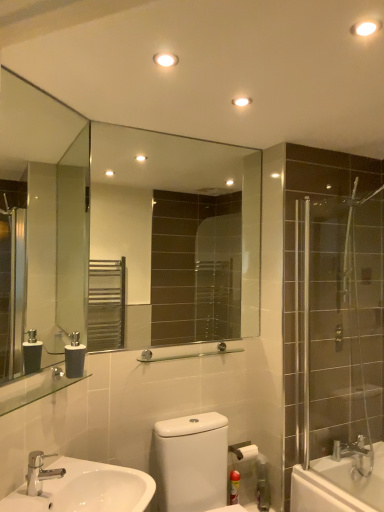
Question: In the image, is chrome metallic faucet at lower left positioned in front of or behind matte gray soap dispenser at lower left?

Choices:
 (A) behind
 (B) front

Answer: (B)

Question: From a real-world perspective, is chrome metallic faucet at lower left above or below matte gray soap dispenser at lower left?

Choices:
 (A) above
 (B) below

Answer: (B)

Question: Which is nearer to the clear glass shower door at right?

Choices:
 (A) white glossy sink at lower left
 (B) clear glass towel bar at center, placed as the 1th balustrade when sorted from right to left
 (C) matte gray soap dispenser at lower left
 (D) clear glass shelf at lower left, positioned as the first balustrade in left-to-right order
 (E) white glossy toilet at lower center

Answer: (B)

Question: Based on their relative distances, which object is farther from the white glossy toilet at lower center?

Choices:
 (A) matte plastic canister at lower right
 (B) matte gray soap dispenser at lower left
 (C) clear glass mirror at center, the 1th mirror viewed from the right
 (D) clear glass shelf at lower left, acting as the 1th balustrade starting from the front
 (E) white glossy sink at lower left

Answer: (C)